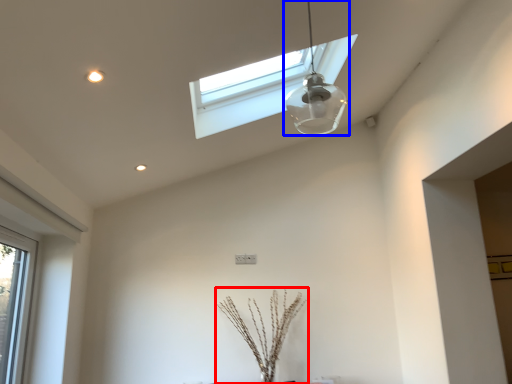
Question: Among these objects, which one is nearest to the camera, plant (highlighted by a red box) or lamp (highlighted by a blue box)?

Choices:
 (A) plant
 (B) lamp

Answer: (B)